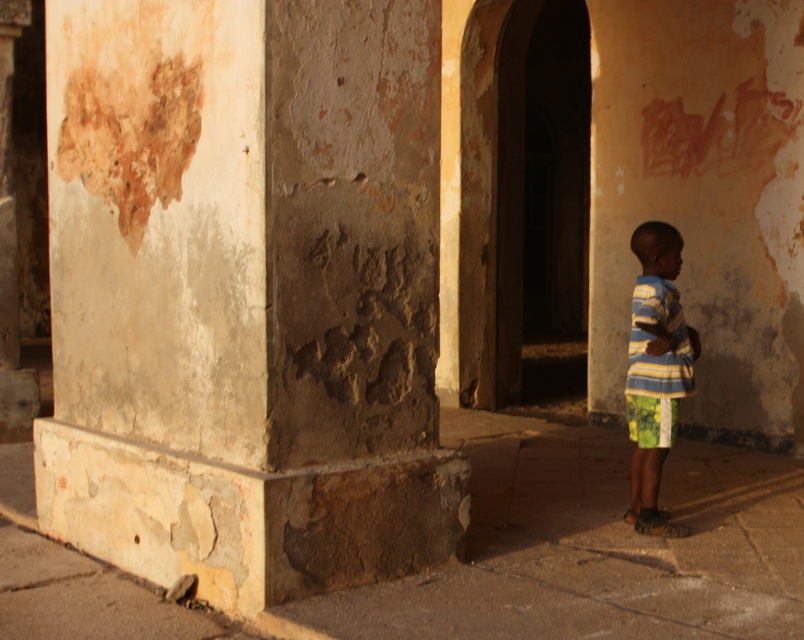
Question: Where is rusty concrete pillar at center located in relation to striped fabric shirt at right in the image?

Choices:
 (A) left
 (B) right

Answer: (A)

Question: Which of the following is the closest to the observer?

Choices:
 (A) (673, 440)
 (B) (643, 276)

Answer: (A)

Question: Is rusty concrete pillar at center further to camera compared to green fabric shorts at lower right?

Choices:
 (A) no
 (B) yes

Answer: (A)

Question: Is the position of rusty concrete pillar at center less distant than that of green fabric shorts at lower right?

Choices:
 (A) yes
 (B) no

Answer: (A)

Question: Which is nearer to the striped fabric shirt at right?

Choices:
 (A) rusty concrete pillar at center
 (B) green fabric shorts at lower right

Answer: (B)

Question: Among these points, which one is farthest from the camera?

Choices:
 (A) 249,444
 (B) 643,273

Answer: (B)